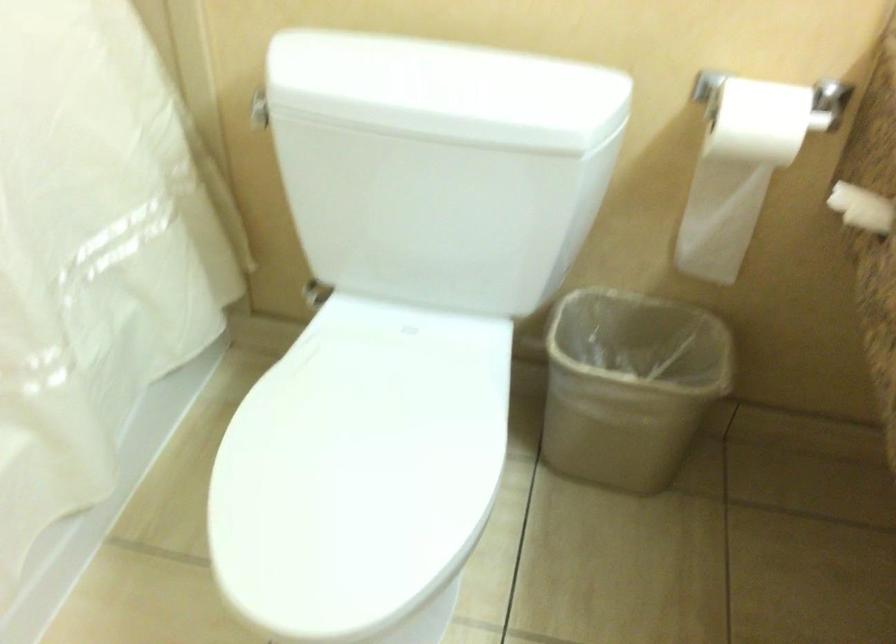
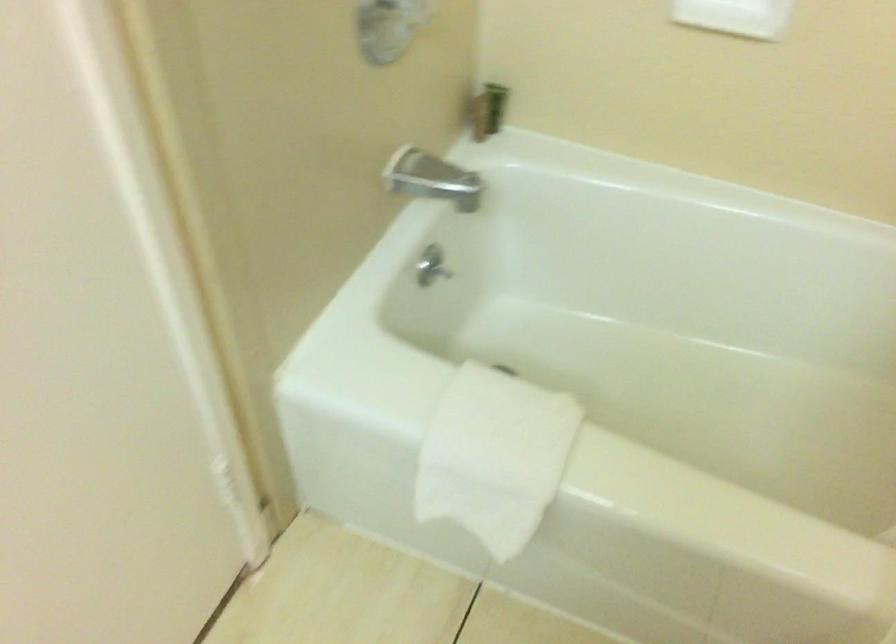
How did the camera likely rotate?

The camera's rotation is toward left-down.